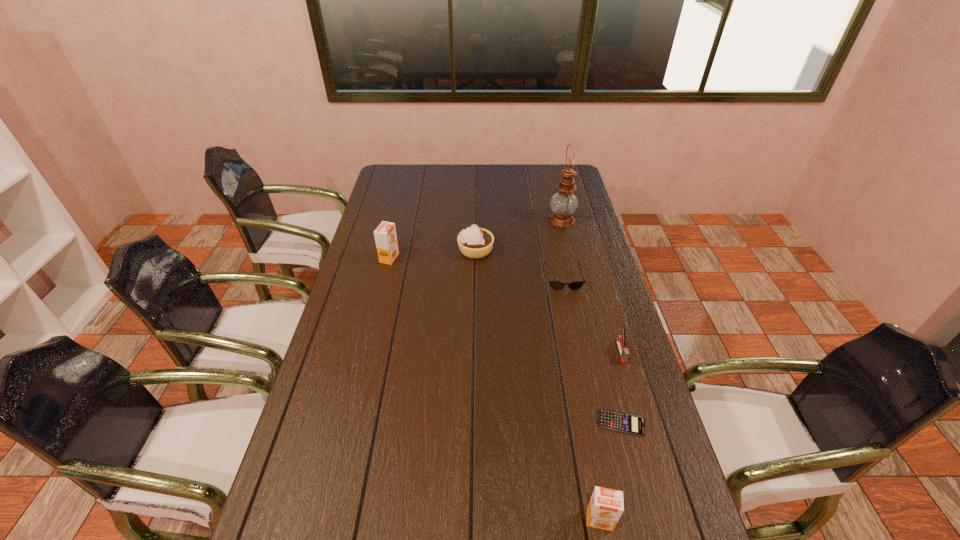
Find the location of a particular element. stapler is located at coordinates click(x=620, y=340).

In order to click on the fifth farthest object in this screenshot , I will do `click(620, 340)`.

The image size is (960, 540). What are the coordinates of `calculator` in the screenshot? It's located at (623, 422).

Identify the location of the second nearest object. Image resolution: width=960 pixels, height=540 pixels. (623, 422).

Where is `vacant area situated 0.210m on the front of the leftmost object`? Image resolution: width=960 pixels, height=540 pixels. vacant area situated 0.210m on the front of the leftmost object is located at coordinates (378, 306).

This screenshot has height=540, width=960. Find the location of `vacant space situated 0.060m on the right of the right orange juice`. vacant space situated 0.060m on the right of the right orange juice is located at coordinates (641, 519).

The height and width of the screenshot is (540, 960). What are the coordinates of `vacant area located on the front of the oil lamp` in the screenshot? It's located at (578, 289).

Locate an element on the screen. This screenshot has width=960, height=540. free space located on the front lenses of the fourth farthest object is located at coordinates (586, 387).

Locate an element on the screen. The width and height of the screenshot is (960, 540). vacant area situated on the back of the whipped cream is located at coordinates (476, 200).

What are the coordinates of `free space located on the handle side of the fifth farthest object` in the screenshot? It's located at point(659,481).